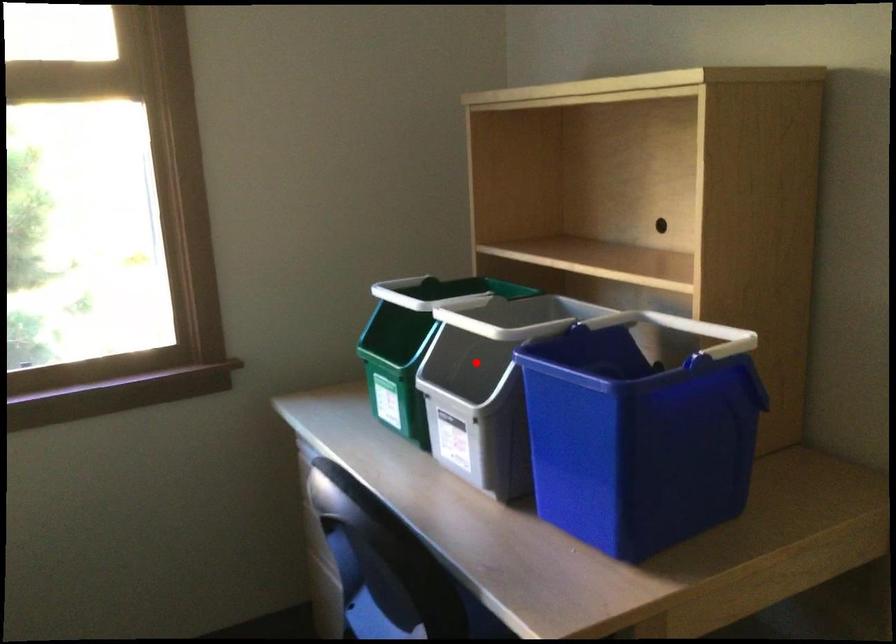
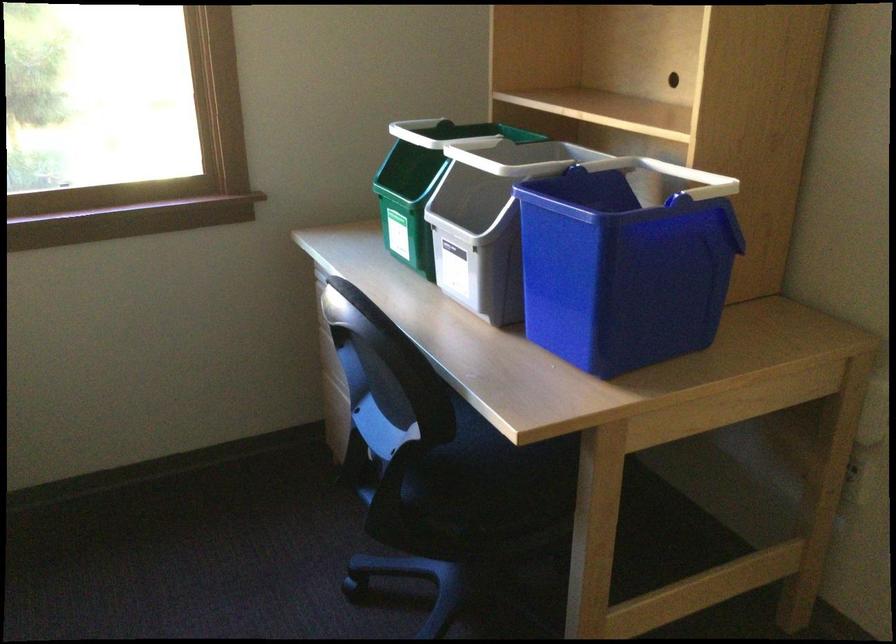
Question: I am providing you with two images of the same scene from different viewpoints. A red point is marked on the first image. Is the red point's position out of view in image 2?

Choices:
 (A) Yes
 (B) No

Answer: (B)